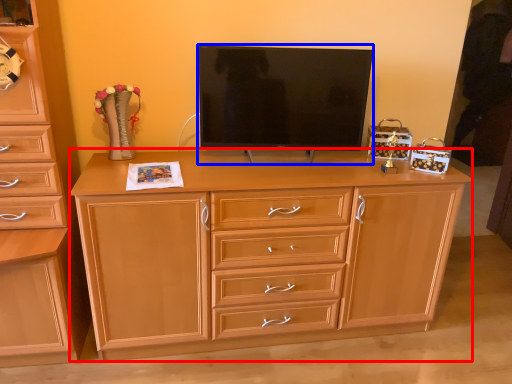
Question: Which object appears closest to the camera in this image, chest of drawers (highlighted by a red box) or television (highlighted by a blue box)?

Choices:
 (A) chest of drawers
 (B) television

Answer: (A)